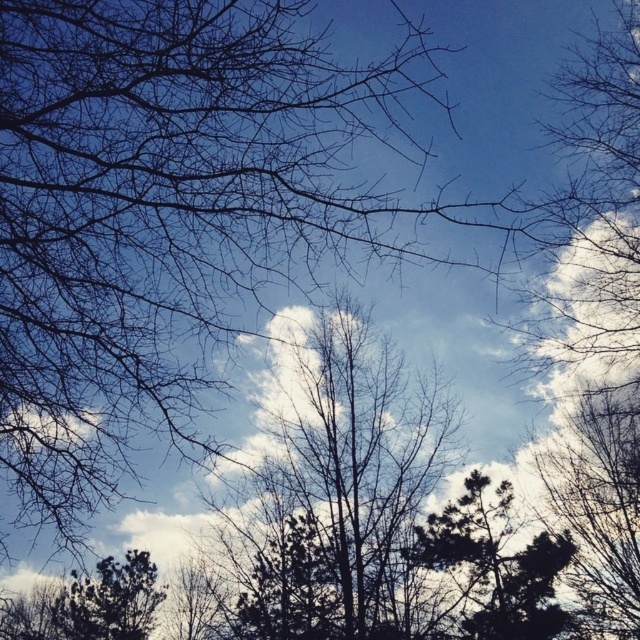
Question: In this image, where is brown/dry wood tree at center located relative to dark green textured tree at center?

Choices:
 (A) below
 (B) above

Answer: (B)

Question: Which point is farther from the camera taking this photo?

Choices:
 (A) (406, 464)
 (B) (506, 564)

Answer: (B)

Question: Does brown/dry wood tree at center have a larger size compared to dark green textured tree at center?

Choices:
 (A) no
 (B) yes

Answer: (B)

Question: Is brown/dry wood tree at center to the right of dark green textured tree at center from the viewer's perspective?

Choices:
 (A) no
 (B) yes

Answer: (A)